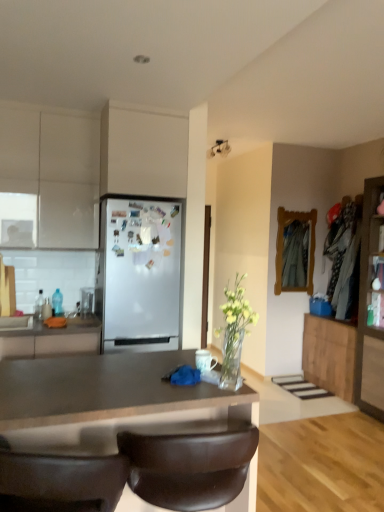
Question: From a real-world perspective, is matte white countertop at left, which is the 4th cabinetry in right-to-left order, physically below wooden cabinet at right, which is the 2th cabinetry from right to left?

Choices:
 (A) no
 (B) yes

Answer: (A)

Question: From the image's perspective, is matte white countertop at left, which is the 4th cabinetry in right-to-left order, above wooden cabinet at right, which is the 2th cabinetry from right to left?

Choices:
 (A) yes
 (B) no

Answer: (A)

Question: Is matte white countertop at left, which is the 4th cabinetry in right-to-left order, aimed at wooden cabinet at right, which is the 2th cabinetry from right to left?

Choices:
 (A) yes
 (B) no

Answer: (B)

Question: Is matte white countertop at left, which is the 4th cabinetry in right-to-left order, further to camera compared to wooden cabinet at right, acting as the 4th cabinetry starting from the left?

Choices:
 (A) no
 (B) yes

Answer: (A)

Question: Does matte white countertop at left, which is the 4th cabinetry in right-to-left order, have a lesser height compared to wooden cabinet at right, which is the 2th cabinetry from right to left?

Choices:
 (A) no
 (B) yes

Answer: (B)

Question: From a real-world perspective, is matte brown countertop at center located higher than white matte cabinet at upper left, marked as the first cabinetry in a left-to-right arrangement?

Choices:
 (A) yes
 (B) no

Answer: (B)

Question: From the image's perspective, is matte brown countertop at center beneath white matte cabinet at upper left, the 5th cabinetry when ordered from right to left?

Choices:
 (A) yes
 (B) no

Answer: (A)

Question: From the image's perspective, does matte brown countertop at center appear higher than white matte cabinet at upper left, marked as the first cabinetry in a left-to-right arrangement?

Choices:
 (A) no
 (B) yes

Answer: (A)

Question: Can you confirm if matte brown countertop at center is taller than white matte cabinet at upper left, marked as the first cabinetry in a left-to-right arrangement?

Choices:
 (A) no
 (B) yes

Answer: (A)

Question: Is matte brown countertop at center positioned beyond the bounds of white matte cabinet at upper left, marked as the first cabinetry in a left-to-right arrangement?

Choices:
 (A) yes
 (B) no

Answer: (A)

Question: Can you confirm if matte brown countertop at center is positioned to the left of white matte cabinet at upper left, marked as the first cabinetry in a left-to-right arrangement?

Choices:
 (A) yes
 (B) no

Answer: (B)

Question: From the image's perspective, would you say brown leather chair at lower center is positioned over wooden cabinet at right, the fifth cabinetry positioned from the left?

Choices:
 (A) yes
 (B) no

Answer: (B)